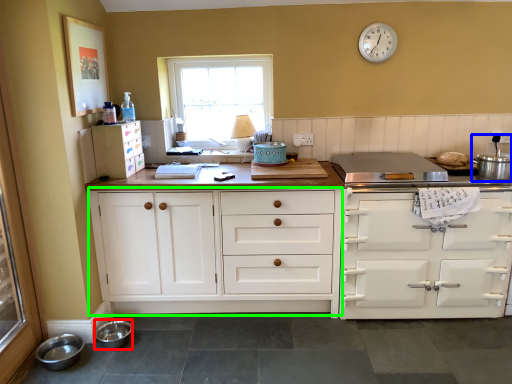
Question: Estimate the real-world distances between objects in this image. Which object is closer to bowl (highlighted by a red box), appliance (highlighted by a blue box) or cabinetry (highlighted by a green box)?

Choices:
 (A) appliance
 (B) cabinetry

Answer: (B)